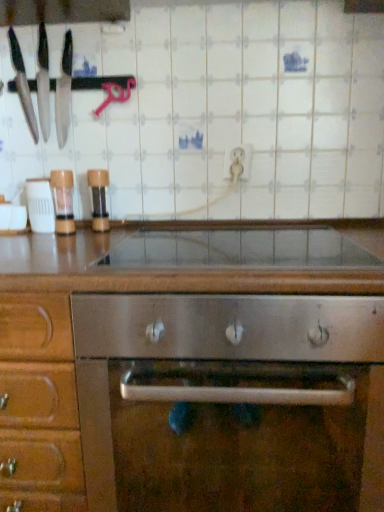
Question: Considering the positions of point (39, 45) and point (292, 250), is point (39, 45) closer or farther from the camera than point (292, 250)?

Choices:
 (A) farther
 (B) closer

Answer: (B)

Question: From the image's perspective, relative to stainless steel oven at center, is stainless steel knives at left, which is counted as the first kitchen appliance, starting from the right, above or below?

Choices:
 (A) below
 (B) above

Answer: (B)

Question: Estimate the real-world distances between objects in this image. Which object is closer to the stainless steel oven at center?

Choices:
 (A) clear plastic shaker at left, placed as the second appliance when sorted from left to right
 (B) transparent glass countertop at center
 (C) matte black knives at left, the 2th kitchen appliance viewed from the right
 (D) stainless steel knives at left, which is counted as the first kitchen appliance, starting from the right
 (E) white plastic container at left, which is the first appliance from left to right

Answer: (B)

Question: Which object is positioned farthest from the transparent glass countertop at center?

Choices:
 (A) brown wood pepper grinder at left, which ranks as the first appliance in right-to-left order
 (B) stainless steel oven at center
 (C) stainless steel knives at left, which ranks as the 2th kitchen appliance in left-to-right order
 (D) matte black knives at left, the 2th kitchen appliance viewed from the right
 (E) white plastic container at left, which is the first appliance from left to right

Answer: (D)